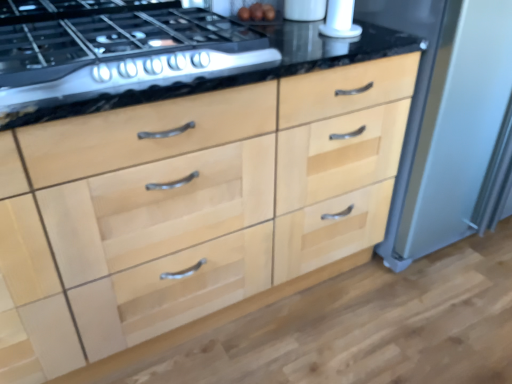
Where is `natural wood drawers at center`? This screenshot has height=384, width=512. natural wood drawers at center is located at coordinates (191, 202).

Describe the element at coordinates (451, 124) in the screenshot. This screenshot has width=512, height=384. I see `satin silver refrigerator at right, which is the 2th appliance in left-to-right order` at that location.

The image size is (512, 384). Describe the element at coordinates (340, 20) in the screenshot. I see `white glossy salt shaker at upper right, the 1th appliance in the left-to-right sequence` at that location.

How much space does white glossy salt shaker at upper right, which is the second appliance from right to left, occupy vertically?

The height of white glossy salt shaker at upper right, which is the second appliance from right to left, is 12.74 inches.

Locate an element on the screen. natural wood drawers at center is located at coordinates (191, 202).

Is there a large distance between satin black gas stove at upper left and natural wood drawers at center?

No.

Is satin black gas stove at upper left completely or partially outside of natural wood drawers at center?

That's correct, satin black gas stove at upper left is outside of natural wood drawers at center.

Is point (173, 34) farther from camera compared to point (67, 170)?

Yes, point (173, 34) is behind point (67, 170).

Measure the distance between satin black gas stove at upper left and natural wood drawers at center.

satin black gas stove at upper left is 14.22 inches from natural wood drawers at center.

Based on the photo, considering the sizes of satin black gas stove at upper left and satin silver refrigerator at right, which is the 2th appliance in left-to-right order, in the image, is satin black gas stove at upper left bigger or smaller than satin silver refrigerator at right, which is the 2th appliance in left-to-right order,?

Clearly, satin black gas stove at upper left is smaller in size than satin silver refrigerator at right, which is the 2th appliance in left-to-right order.

Which object is positioned more to the left, satin black gas stove at upper left or satin silver refrigerator at right, which is the 2th appliance in left-to-right order?

Positioned to the left is satin black gas stove at upper left.

Is there a large distance between satin black gas stove at upper left and satin silver refrigerator at right, which is the 1th appliance from right to left?

satin black gas stove at upper left is actually quite close to satin silver refrigerator at right, which is the 1th appliance from right to left.

In terms of width, does natural wood drawers at center look wider or thinner when compared to satin silver refrigerator at right, which is the 2th appliance in left-to-right order?

Considering their sizes, natural wood drawers at center looks slimmer than satin silver refrigerator at right, which is the 2th appliance in left-to-right order.

From a real-world perspective, relative to satin silver refrigerator at right, which is the 2th appliance in left-to-right order, is natural wood drawers at center vertically above or below?

natural wood drawers at center is below satin silver refrigerator at right, which is the 2th appliance in left-to-right order.

Is natural wood drawers at center further to camera compared to satin silver refrigerator at right, which is the 2th appliance in left-to-right order?

No.

Considering the relative positions of natural wood drawers at center and satin silver refrigerator at right, which is the 1th appliance from right to left, in the image provided, is natural wood drawers at center to the left of satin silver refrigerator at right, which is the 1th appliance from right to left, from the viewer's perspective?

Yes.

Based on their sizes in the image, would you say natural wood drawers at center is bigger or smaller than white glossy salt shaker at upper right, which is the second appliance from right to left?

Considering their sizes, natural wood drawers at center takes up more space than white glossy salt shaker at upper right, which is the second appliance from right to left.

Considering the relative positions of natural wood drawers at center and white glossy salt shaker at upper right, the 1th appliance in the left-to-right sequence, in the image provided, is natural wood drawers at center in front of white glossy salt shaker at upper right, the 1th appliance in the left-to-right sequence,?

Yes, it is.

Which is less distant, (x=62, y=339) or (x=323, y=29)?

The point (x=62, y=339) is closer to the camera.

Based on the photo, from the image's perspective, which is below, natural wood drawers at center or white glossy salt shaker at upper right, the 1th appliance in the left-to-right sequence?

natural wood drawers at center.

I want to click on gas stove on the left of white glossy salt shaker at upper right, the 1th appliance in the left-to-right sequence, so click(x=106, y=36).

Does point (352, 35) come in front of point (40, 3)?

Yes.

Considering the sizes of objects white glossy salt shaker at upper right, the 1th appliance in the left-to-right sequence, and satin black gas stove at upper left in the image provided, who is smaller, white glossy salt shaker at upper right, the 1th appliance in the left-to-right sequence, or satin black gas stove at upper left?

With smaller size is white glossy salt shaker at upper right, the 1th appliance in the left-to-right sequence.

Is white glossy salt shaker at upper right, which is the second appliance from right to left, directly adjacent to satin black gas stove at upper left?

No, white glossy salt shaker at upper right, which is the second appliance from right to left, is not next to satin black gas stove at upper left.

In terms of width, does white glossy salt shaker at upper right, which is the second appliance from right to left, look wider or thinner when compared to natural wood drawers at center?

Considering their sizes, white glossy salt shaker at upper right, which is the second appliance from right to left, looks slimmer than natural wood drawers at center.

Is white glossy salt shaker at upper right, the 1th appliance in the left-to-right sequence, looking in the opposite direction of natural wood drawers at center?

No, natural wood drawers at center is not at the back of white glossy salt shaker at upper right, the 1th appliance in the left-to-right sequence.

Which is correct: white glossy salt shaker at upper right, which is the second appliance from right to left, is inside natural wood drawers at center, or outside of it?

white glossy salt shaker at upper right, which is the second appliance from right to left, cannot be found inside natural wood drawers at center.

Based on their sizes in the image, would you say satin silver refrigerator at right, which is the 1th appliance from right to left, is bigger or smaller than white glossy salt shaker at upper right, which is the second appliance from right to left?

Clearly, satin silver refrigerator at right, which is the 1th appliance from right to left, is larger in size than white glossy salt shaker at upper right, which is the second appliance from right to left.

Would you say satin silver refrigerator at right, which is the 2th appliance in left-to-right order, is to the left or to the right of white glossy salt shaker at upper right, the 1th appliance in the left-to-right sequence, in the picture?

satin silver refrigerator at right, which is the 2th appliance in left-to-right order, is positioned on white glossy salt shaker at upper right, the 1th appliance in the left-to-right sequence,'s right side.

Looking at this image, does satin silver refrigerator at right, which is the 2th appliance in left-to-right order, touch white glossy salt shaker at upper right, the 1th appliance in the left-to-right sequence?

satin silver refrigerator at right, which is the 2th appliance in left-to-right order, is not next to white glossy salt shaker at upper right, the 1th appliance in the left-to-right sequence, and they're not touching.

From the image's perspective, is satin silver refrigerator at right, which is the 2th appliance in left-to-right order, over white glossy salt shaker at upper right, which is the second appliance from right to left?

No.

Locate an element on the screen. The image size is (512, 384). chest of drawers on the right of satin black gas stove at upper left is located at coordinates (191, 202).

Find the location of a particular element. The width and height of the screenshot is (512, 384). the 1st appliance behind the satin black gas stove at upper left, starting your count from the anchor is located at coordinates (451, 124).

Looking at the image, which one is located closer to natural wood drawers at center, satin silver refrigerator at right, which is the 2th appliance in left-to-right order, or white glossy salt shaker at upper right, which is the second appliance from right to left?

Based on the image, satin silver refrigerator at right, which is the 2th appliance in left-to-right order, appears to be nearer to natural wood drawers at center.

From the image, which object appears to be nearer to white glossy salt shaker at upper right, the 1th appliance in the left-to-right sequence, satin black gas stove at upper left or satin silver refrigerator at right, which is the 1th appliance from right to left?

Based on the image, satin silver refrigerator at right, which is the 1th appliance from right to left, appears to be nearer to white glossy salt shaker at upper right, the 1th appliance in the left-to-right sequence.

From the image, which object appears to be farther from satin black gas stove at upper left, satin silver refrigerator at right, which is the 1th appliance from right to left, or white glossy salt shaker at upper right, the 1th appliance in the left-to-right sequence?

satin silver refrigerator at right, which is the 1th appliance from right to left, is positioned further to the anchor satin black gas stove at upper left.

Based on their spatial positions, is satin black gas stove at upper left or satin silver refrigerator at right, which is the 2th appliance in left-to-right order, further from natural wood drawers at center?

Based on the image, satin silver refrigerator at right, which is the 2th appliance in left-to-right order, appears to be further to natural wood drawers at center.

Estimate the real-world distances between objects in this image. Which object is closer to natural wood drawers at center, white glossy salt shaker at upper right, which is the second appliance from right to left, or satin silver refrigerator at right, which is the 2th appliance in left-to-right order?

Based on the image, satin silver refrigerator at right, which is the 2th appliance in left-to-right order, appears to be nearer to natural wood drawers at center.

From the image, which object appears to be farther from satin silver refrigerator at right, which is the 1th appliance from right to left, natural wood drawers at center or white glossy salt shaker at upper right, which is the second appliance from right to left?

The object further to satin silver refrigerator at right, which is the 1th appliance from right to left, is natural wood drawers at center.

Based on their spatial positions, is satin black gas stove at upper left or white glossy salt shaker at upper right, which is the second appliance from right to left, closer to natural wood drawers at center?

satin black gas stove at upper left is closer to natural wood drawers at center.

Based on their spatial positions, is white glossy salt shaker at upper right, the 1th appliance in the left-to-right sequence, or satin black gas stove at upper left closer to satin silver refrigerator at right, which is the 1th appliance from right to left?

Based on the image, white glossy salt shaker at upper right, the 1th appliance in the left-to-right sequence, appears to be nearer to satin silver refrigerator at right, which is the 1th appliance from right to left.

The image size is (512, 384). I want to click on appliance between natural wood drawers at center and satin silver refrigerator at right, which is the 2th appliance in left-to-right order, from left to right, so click(340, 20).

Locate an element on the screen. The image size is (512, 384). the chest of drawers located between satin black gas stove at upper left and satin silver refrigerator at right, which is the 2th appliance in left-to-right order, in the left-right direction is located at coordinates (191, 202).

Locate an element on the screen. The height and width of the screenshot is (384, 512). the chest of drawers situated between satin black gas stove at upper left and white glossy salt shaker at upper right, the 1th appliance in the left-to-right sequence, from left to right is located at coordinates (191, 202).

The width and height of the screenshot is (512, 384). What are the coordinates of `appliance between satin black gas stove at upper left and satin silver refrigerator at right, which is the 1th appliance from right to left, from left to right` in the screenshot? It's located at (340, 20).